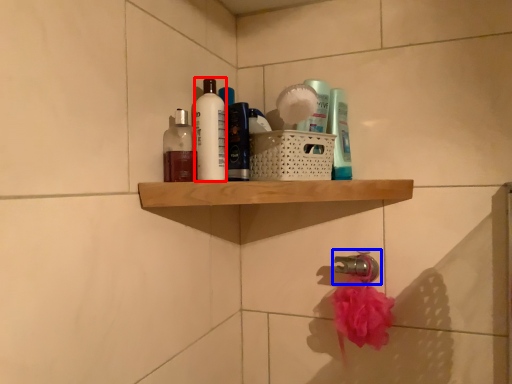
Question: Which object appears farthest to the camera in this image, cleaning product (highlighted by a red box) or tap (highlighted by a blue box)?

Choices:
 (A) cleaning product
 (B) tap

Answer: (B)